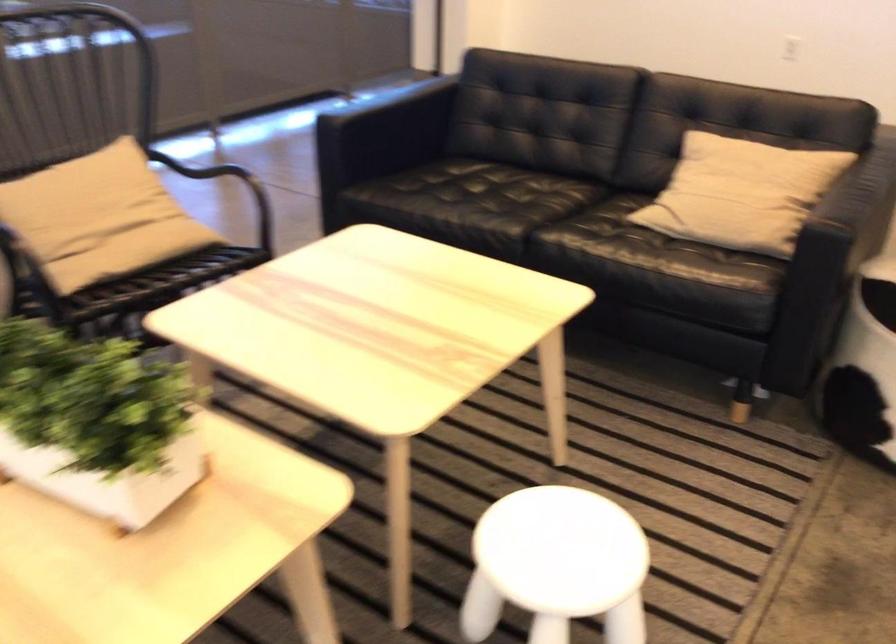
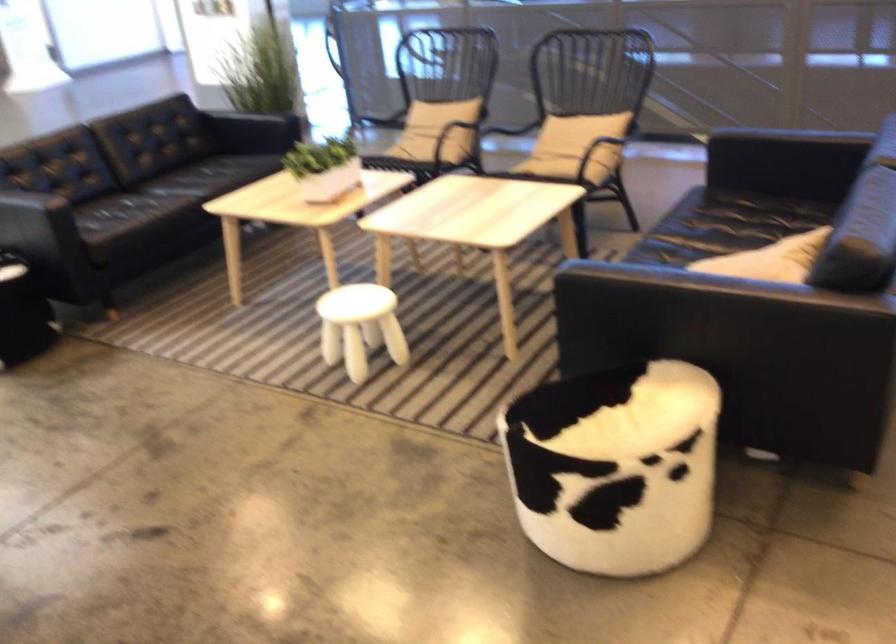
Where in the second image is the point corresponding to (x=815, y=147) from the first image?

(770, 259)